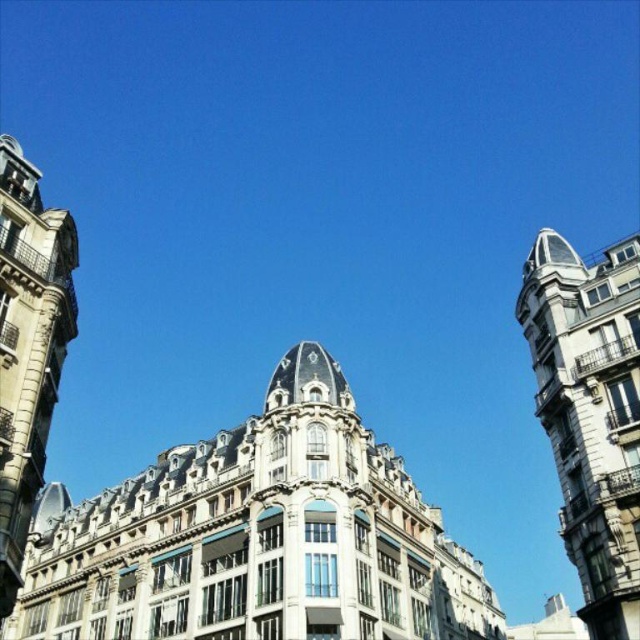
Question: Which point is closer to the camera?

Choices:
 (A) (275, 554)
 (B) (586, 344)
 (C) (76, 259)

Answer: (C)

Question: In this image, where is white stone tower at upper right located relative to stone tower at left?

Choices:
 (A) left
 (B) right

Answer: (B)

Question: Does white stone tower at upper right appear on the right side of stone tower at left?

Choices:
 (A) no
 (B) yes

Answer: (B)

Question: Which of the following is the closest to the observer?

Choices:
 (A) stone tower at left
 (B) white stone tower at upper right

Answer: (A)

Question: Which point is farther to the camera?

Choices:
 (A) white stone tower at upper right
 (B) white stone building at center
 (C) stone tower at left

Answer: (A)

Question: Can you confirm if white stone tower at upper right is positioned to the right of stone tower at left?

Choices:
 (A) yes
 (B) no

Answer: (A)